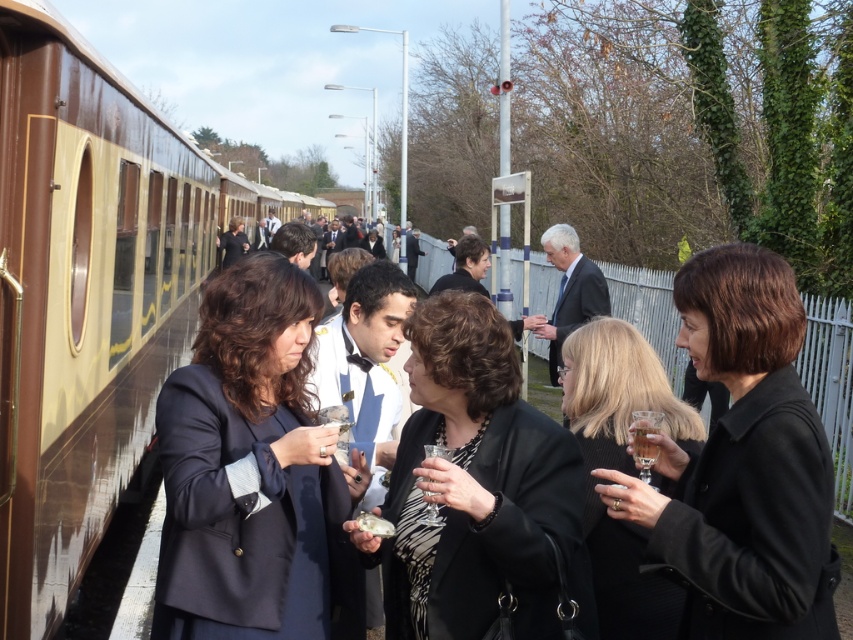
Is point (775, 298) behind point (625, 355)?

No, (775, 298) is closer to viewer.

Does black matte coat at right have a larger size compared to blonde hair at center?

No.

The image size is (853, 640). Describe the element at coordinates (743, 464) in the screenshot. I see `black matte coat at right` at that location.

Where is `black matte coat at right`? The height and width of the screenshot is (640, 853). black matte coat at right is located at coordinates (743, 464).

Can you confirm if navy blue fabric at center is taller than blonde hair at center?

Yes, navy blue fabric at center is taller than blonde hair at center.

Between navy blue fabric at center and blonde hair at center, which one has less height?

blonde hair at center

Is point (281, 372) in front of point (643, 596)?

Yes, point (281, 372) is closer to viewer.

Locate an element on the screen. navy blue fabric at center is located at coordinates (252, 474).

Between navy blue fabric at center and black textured dress at center, which one has less height?

Standing shorter between the two is black textured dress at center.

Is navy blue fabric at center taller than black textured dress at center?

Yes.

Where is `navy blue fabric at center`? The width and height of the screenshot is (853, 640). navy blue fabric at center is located at coordinates (252, 474).

What are the coordinates of `navy blue fabric at center` in the screenshot? It's located at (252, 474).